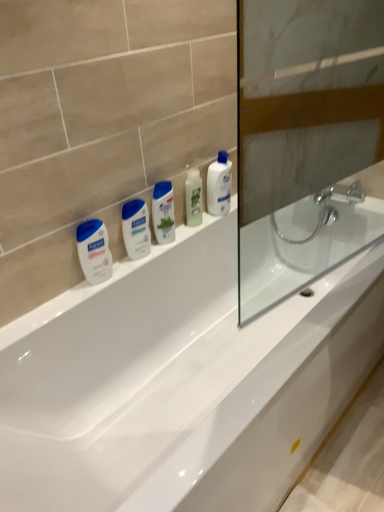
The height and width of the screenshot is (512, 384). What do you see at coordinates (163, 212) in the screenshot? I see `green matte mouthwash at center, which ranks as the third mouthwash in left-to-right order` at bounding box center [163, 212].

The image size is (384, 512). Identify the location of white glossy mouthwash at center, positioned as the second mouthwash in left-to-right order. (136, 228).

How much space does white glossy mouthwash at center, positioned as the second mouthwash in left-to-right order, occupy horizontally?

white glossy mouthwash at center, positioned as the second mouthwash in left-to-right order, is 2.22 inches in width.

What is the approximate height of white glossy lotion at left, which is the fourth mouthwash in right-to-left order?

white glossy lotion at left, which is the fourth mouthwash in right-to-left order, is 7.86 inches in height.

You are a GUI agent. You are given a task and a screenshot of the screen. Output one action in this format:
    pyautogui.click(x=<x>, y=<y>)
    Task: Click on the white glossy mouthwash at center, which is the first mouthwash in right-to-left order
    The height and width of the screenshot is (512, 384).
    Given the screenshot: What is the action you would take?
    pyautogui.click(x=193, y=198)

Do you think white glossy lotion at left, which is the fourth mouthwash in right-to-left order, is within green matte mouthwash at center, marked as the 2th mouthwash in a right-to-left arrangement, or outside of it?

white glossy lotion at left, which is the fourth mouthwash in right-to-left order, is outside green matte mouthwash at center, marked as the 2th mouthwash in a right-to-left arrangement.

Does white glossy lotion at left, the first mouthwash in the left-to-right sequence, appear on the right side of green matte mouthwash at center, which ranks as the third mouthwash in left-to-right order?

In fact, white glossy lotion at left, the first mouthwash in the left-to-right sequence, is to the left of green matte mouthwash at center, which ranks as the third mouthwash in left-to-right order.

Is green matte mouthwash at center, which ranks as the third mouthwash in left-to-right order, at the back of white glossy lotion at left, which is the fourth mouthwash in right-to-left order?

white glossy lotion at left, which is the fourth mouthwash in right-to-left order, is not turned away from green matte mouthwash at center, which ranks as the third mouthwash in left-to-right order.

Considering the positions of objects transparent glass screen door at right and white glossy lotion at left, which is the fourth mouthwash in right-to-left order, in the image provided, who is behind, transparent glass screen door at right or white glossy lotion at left, which is the fourth mouthwash in right-to-left order,?

white glossy lotion at left, which is the fourth mouthwash in right-to-left order, is more distant.

Based on their sizes in the image, would you say transparent glass screen door at right is bigger or smaller than white glossy lotion at left, which is the fourth mouthwash in right-to-left order?

Considering their sizes, transparent glass screen door at right takes up more space than white glossy lotion at left, which is the fourth mouthwash in right-to-left order.

Does transparent glass screen door at right touch white glossy lotion at left, the first mouthwash in the left-to-right sequence?

transparent glass screen door at right is not next to white glossy lotion at left, the first mouthwash in the left-to-right sequence, and they're not touching.

Consider the image. How different are the orientations of white glossy bathtub at center and white glossy mouthwash at center, which is the first mouthwash in right-to-left order, in degrees?

The angular difference between white glossy bathtub at center and white glossy mouthwash at center, which is the first mouthwash in right-to-left order, is 1.03 degrees.

Can you see white glossy bathtub at center touching white glossy mouthwash at center, which is counted as the fourth mouthwash, starting from the left?

They are not placed beside each other.

The width and height of the screenshot is (384, 512). Identify the location of bathtub lying below the white glossy mouthwash at center, which is the first mouthwash in right-to-left order (from the image's perspective). (180, 382).

Between green matte mouthwash at center, which ranks as the third mouthwash in left-to-right order, and white glossy lotion at left, the first mouthwash in the left-to-right sequence, which one has smaller width?

With smaller width is white glossy lotion at left, the first mouthwash in the left-to-right sequence.

From a real-world perspective, which is physically below, green matte mouthwash at center, which ranks as the third mouthwash in left-to-right order, or white glossy lotion at left, which is the fourth mouthwash in right-to-left order?

white glossy lotion at left, which is the fourth mouthwash in right-to-left order, from a real-world perspective.

From the image's perspective, is green matte mouthwash at center, which ranks as the third mouthwash in left-to-right order, on top of white glossy lotion at left, the first mouthwash in the left-to-right sequence?

Correct, green matte mouthwash at center, which ranks as the third mouthwash in left-to-right order, appears higher than white glossy lotion at left, the first mouthwash in the left-to-right sequence, in the image.

How distant is green matte mouthwash at center, which ranks as the third mouthwash in left-to-right order, from white glossy lotion at left, the first mouthwash in the left-to-right sequence?

green matte mouthwash at center, which ranks as the third mouthwash in left-to-right order, is 9.47 inches away from white glossy lotion at left, the first mouthwash in the left-to-right sequence.

The width and height of the screenshot is (384, 512). There is a white plastic bottle at center. Identify the location of the 3rd mouthwash below it (from the image's perspective). 136,228.

Considering the positions of objects white plastic bottle at center and white glossy mouthwash at center, positioned as the second mouthwash in left-to-right order, in the image provided, who is more to the left, white plastic bottle at center or white glossy mouthwash at center, positioned as the second mouthwash in left-to-right order,?

white glossy mouthwash at center, positioned as the second mouthwash in left-to-right order, is more to the left.

Is point (225, 155) positioned in front of point (141, 239)?

No, (225, 155) is behind (141, 239).

Is white plastic bottle at center positioned with its back to white glossy mouthwash at center, positioned as the second mouthwash in left-to-right order?

No, white plastic bottle at center is not facing away from white glossy mouthwash at center, positioned as the second mouthwash in left-to-right order.

Is point (218, 166) positioned behind point (356, 226)?

No, (218, 166) is in front of (356, 226).

At what (x,y) coordinates should I click in order to perform the action: click on cleaning product on the left of transparent glass screen door at right. Please return your answer as a coordinate pair (x, y). Looking at the image, I should click on (219, 185).

Is white plastic bottle at center oriented away from transparent glass screen door at right?

No.

Between white plastic bottle at center and transparent glass screen door at right, which one appears on the right side from the viewer's perspective?

From the viewer's perspective, transparent glass screen door at right appears more on the right side.

In the scene shown: From the image's perspective, which is above, white glossy mouthwash at center, placed as the third mouthwash when sorted from right to left, or green matte mouthwash at center, marked as the 2th mouthwash in a right-to-left arrangement?

green matte mouthwash at center, marked as the 2th mouthwash in a right-to-left arrangement.

Considering the relative sizes of white glossy mouthwash at center, positioned as the second mouthwash in left-to-right order, and green matte mouthwash at center, marked as the 2th mouthwash in a right-to-left arrangement, in the image provided, is white glossy mouthwash at center, positioned as the second mouthwash in left-to-right order, smaller than green matte mouthwash at center, marked as the 2th mouthwash in a right-to-left arrangement,?

Correct, white glossy mouthwash at center, positioned as the second mouthwash in left-to-right order, occupies less space than green matte mouthwash at center, marked as the 2th mouthwash in a right-to-left arrangement.

From a real-world perspective, starting from the white glossy mouthwash at center, placed as the third mouthwash when sorted from right to left, which mouthwash is the 2nd one vertically above it? Please provide its 2D coordinates.

[(163, 212)]

Considering the sizes of white glossy mouthwash at center, positioned as the second mouthwash in left-to-right order, and green matte mouthwash at center, marked as the 2th mouthwash in a right-to-left arrangement, in the image, is white glossy mouthwash at center, positioned as the second mouthwash in left-to-right order, taller or shorter than green matte mouthwash at center, marked as the 2th mouthwash in a right-to-left arrangement,?

Clearly, white glossy mouthwash at center, positioned as the second mouthwash in left-to-right order, is shorter compared to green matte mouthwash at center, marked as the 2th mouthwash in a right-to-left arrangement.

Locate an element on the screen. This screenshot has width=384, height=512. the 2nd mouthwash in front of the green matte mouthwash at center, which ranks as the third mouthwash in left-to-right order is located at coordinates (94, 251).

Locate an element on the screen. The height and width of the screenshot is (512, 384). mouthwash that is the 1st object located behind the transparent glass screen door at right is located at coordinates (94, 251).

Estimate the real-world distances between objects in this image. Which object is closer to white glossy mouthwash at center, which is the first mouthwash in right-to-left order, transparent glass screen door at right or green matte mouthwash at center, which ranks as the third mouthwash in left-to-right order?

green matte mouthwash at center, which ranks as the third mouthwash in left-to-right order.

Which object lies nearer to the anchor point white plastic bottle at center, white glossy bathtub at center or green matte mouthwash at center, marked as the 2th mouthwash in a right-to-left arrangement?

Based on the image, green matte mouthwash at center, marked as the 2th mouthwash in a right-to-left arrangement, appears to be nearer to white plastic bottle at center.

Based on the photo, considering their positions, is white plastic bottle at center positioned closer to white glossy lotion at left, which is the fourth mouthwash in right-to-left order, than transparent glass screen door at right?

white plastic bottle at center lies closer to white glossy lotion at left, which is the fourth mouthwash in right-to-left order, than the other object.

When comparing their distances from white glossy mouthwash at center, positioned as the second mouthwash in left-to-right order, does white glossy mouthwash at center, which is the first mouthwash in right-to-left order, or white glossy bathtub at center seem closer?

white glossy mouthwash at center, which is the first mouthwash in right-to-left order, is positioned closer to the anchor white glossy mouthwash at center, positioned as the second mouthwash in left-to-right order.

Estimate the real-world distances between objects in this image. Which object is further from transparent glass screen door at right, white glossy mouthwash at center, positioned as the second mouthwash in left-to-right order, or white glossy bathtub at center?

white glossy mouthwash at center, positioned as the second mouthwash in left-to-right order.

Considering their positions, is white glossy lotion at left, which is the fourth mouthwash in right-to-left order, positioned closer to green matte mouthwash at center, which ranks as the third mouthwash in left-to-right order, than white glossy mouthwash at center, which is the first mouthwash in right-to-left order?

white glossy mouthwash at center, which is the first mouthwash in right-to-left order, is closer to green matte mouthwash at center, which ranks as the third mouthwash in left-to-right order.

Based on their spatial positions, is white glossy lotion at left, the first mouthwash in the left-to-right sequence, or white glossy bathtub at center further from green matte mouthwash at center, marked as the 2th mouthwash in a right-to-left arrangement?

white glossy bathtub at center is further to green matte mouthwash at center, marked as the 2th mouthwash in a right-to-left arrangement.

When comparing their distances from white glossy mouthwash at center, placed as the third mouthwash when sorted from right to left, does white glossy mouthwash at center, which is counted as the fourth mouthwash, starting from the left, or white plastic bottle at center seem further?

The object further to white glossy mouthwash at center, placed as the third mouthwash when sorted from right to left, is white plastic bottle at center.

Identify the location of mouthwash between green matte mouthwash at center, marked as the 2th mouthwash in a right-to-left arrangement, and white plastic bottle at center, in the horizontal direction. This screenshot has width=384, height=512. (193, 198).

Find the location of a particular element. mouthwash between white glossy bathtub at center and white glossy mouthwash at center, placed as the third mouthwash when sorted from right to left, from front to back is located at coordinates (94, 251).

The height and width of the screenshot is (512, 384). What are the coordinates of `mouthwash located between white glossy mouthwash at center, positioned as the second mouthwash in left-to-right order, and white glossy mouthwash at center, which is counted as the fourth mouthwash, starting from the left, in the left-right direction` in the screenshot? It's located at (163, 212).

The height and width of the screenshot is (512, 384). Find the location of `screen door between white glossy bathtub at center and white glossy mouthwash at center, which is the first mouthwash in right-to-left order, along the z-axis`. screen door between white glossy bathtub at center and white glossy mouthwash at center, which is the first mouthwash in right-to-left order, along the z-axis is located at coordinates (305, 140).